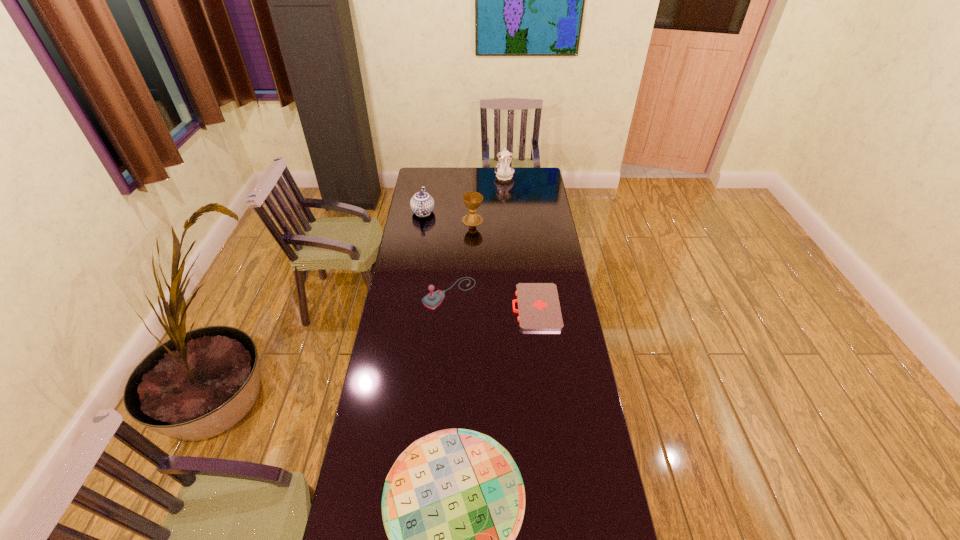
In the image, there is a desktop. At what (x,y) coordinates should I click in order to perform the action: click on vacant space at the left edge. Please return your answer as a coordinate pair (x, y). The image size is (960, 540). Looking at the image, I should click on (411, 197).

The height and width of the screenshot is (540, 960). In the image, there is a desktop. What are the coordinates of `vacant space at the right edge` in the screenshot? It's located at (540, 197).

You are a GUI agent. You are given a task and a screenshot of the screen. Output one action in this format:
    pyautogui.click(x=<x>, y=<y>)
    Task: Click on the free area in between the taller chinaware and the shorter chinaware
    
    Given the screenshot: What is the action you would take?
    pyautogui.click(x=464, y=194)

Identify the location of vacant region between the nearer chinaware and the third shortest object. (436, 253).

Find the location of a particular element. vacant space that's between the nearer chinaware and the farther chinaware is located at coordinates (464, 194).

Identify the location of free space that is in between the nearer chinaware and the chalice. The image size is (960, 540). (448, 216).

This screenshot has height=540, width=960. Find the location of `unoccupied position between the right chinaware and the left chinaware`. unoccupied position between the right chinaware and the left chinaware is located at coordinates (464, 194).

I want to click on free area in between the first-aid kit and the farthest object, so click(x=520, y=242).

Choose which object is the nearest neighbor to the joystick. Please provide its 2D coordinates. Your answer should be formatted as a tuple, i.e. [(x, y)], where the tuple contains the x and y coordinates of a point satisfying the conditions above.

[(539, 309)]

In order to click on object that is the closest to the shorter chinaware in this screenshot , I will do (472, 200).